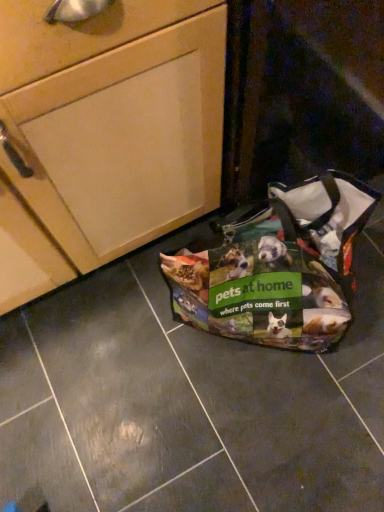
Question: Considering the positions of point (339, 281) and point (71, 266), is point (339, 281) closer or farther from the camera than point (71, 266)?

Choices:
 (A) closer
 (B) farther

Answer: (A)

Question: In terms of height, does printed fabric pet carrier at lower right look taller or shorter compared to matte wood cabinet at upper left?

Choices:
 (A) tall
 (B) short

Answer: (B)

Question: From the image's perspective, is printed fabric pet carrier at lower right above or below matte wood cabinet at upper left?

Choices:
 (A) below
 (B) above

Answer: (A)

Question: Choose the correct answer: Is matte wood cabinet at upper left inside printed fabric pet carrier at lower right or outside it?

Choices:
 (A) outside
 (B) inside

Answer: (A)

Question: From a real-world perspective, is matte wood cabinet at upper left positioned above or below printed fabric pet carrier at lower right?

Choices:
 (A) below
 (B) above

Answer: (B)

Question: Would you say matte wood cabinet at upper left is to the left or to the right of printed fabric pet carrier at lower right in the picture?

Choices:
 (A) left
 (B) right

Answer: (A)

Question: Does point (100, 122) appear closer or farther from the camera than point (218, 308)?

Choices:
 (A) farther
 (B) closer

Answer: (B)